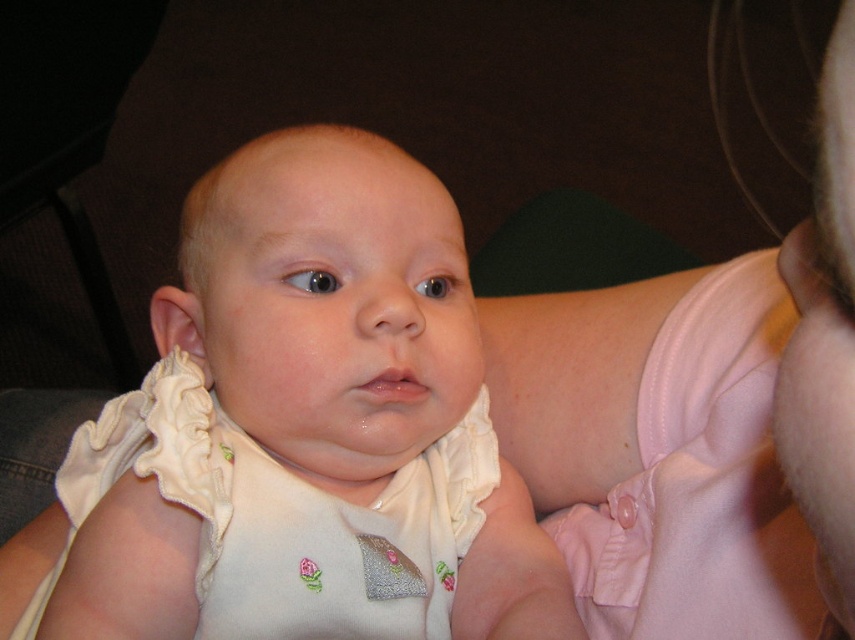
Question: Does white soft fabric baby at center have a greater width compared to white ruffled bib at center?

Choices:
 (A) yes
 (B) no

Answer: (A)

Question: Which point is farther to the camera?

Choices:
 (A) (440, 592)
 (B) (255, 324)

Answer: (A)

Question: Is white soft fabric baby at center bigger than white ruffled bib at center?

Choices:
 (A) yes
 (B) no

Answer: (A)

Question: Is white soft fabric baby at center above white ruffled bib at center?

Choices:
 (A) no
 (B) yes

Answer: (B)

Question: Which point is farther to the camera?

Choices:
 (A) (158, 467)
 (B) (478, 500)

Answer: (B)